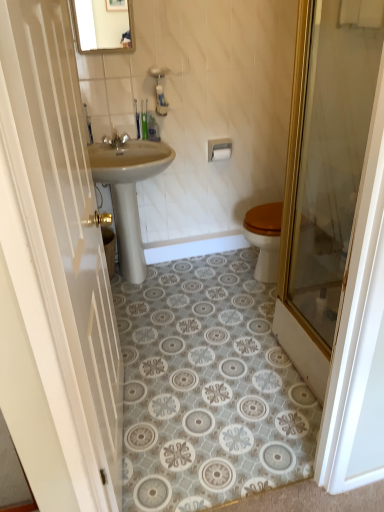
The width and height of the screenshot is (384, 512). Find the location of `white matte toilet paper at upper center`. white matte toilet paper at upper center is located at coordinates (221, 154).

Measure the distance between beige ceramic sink at center and camera.

They are 2.17 meters apart.

I want to click on beige ceramic sink at center, so click(x=128, y=193).

Identify the location of silver metallic towel bar at upper center. (219, 149).

Locate an element on the screen. The height and width of the screenshot is (512, 384). white matte toilet paper at upper center is located at coordinates (221, 154).

Is beige ceramic sink at center bigger or smaller than silver metallic faucet at upper center?

In the image, beige ceramic sink at center appears to be larger than silver metallic faucet at upper center.

Could you tell me if beige ceramic sink at center is turned towards silver metallic faucet at upper center?

No, beige ceramic sink at center is not facing towards silver metallic faucet at upper center.

In the scene shown: What's the angular difference between beige ceramic sink at center and silver metallic faucet at upper center's facing directions?

They differ by 0.0031 degrees in their facing directions.

Can you confirm if silver metallic towel bar at upper center is wider than translucent glass door at right, marked as the first door in a right-to-left arrangement?

Incorrect, the width of silver metallic towel bar at upper center does not surpass that of translucent glass door at right, marked as the first door in a right-to-left arrangement.

Consider the image. Is silver metallic towel bar at upper center inside or outside of translucent glass door at right, which is the 2th door in left-to-right order?

silver metallic towel bar at upper center cannot be found inside translucent glass door at right, which is the 2th door in left-to-right order.

From the image's perspective, which one is positioned higher, silver metallic towel bar at upper center or translucent glass door at right, which is the 2th door in left-to-right order?

silver metallic towel bar at upper center appears higher in the image.

Which object is closer to the camera taking this photo, silver metallic towel bar at upper center or translucent glass door at right, marked as the first door in a right-to-left arrangement?

translucent glass door at right, marked as the first door in a right-to-left arrangement.

How different are the orientations of white matte toilet paper at upper center and silver metallic towel bar at upper center in degrees?

white matte toilet paper at upper center and silver metallic towel bar at upper center are facing 1.89 degrees away from each other.

Considering the sizes of objects white matte toilet paper at upper center and silver metallic towel bar at upper center in the image provided, who is taller, white matte toilet paper at upper center or silver metallic towel bar at upper center?

Standing taller between the two is silver metallic towel bar at upper center.

How distant is white matte toilet paper at upper center from silver metallic towel bar at upper center?

white matte toilet paper at upper center and silver metallic towel bar at upper center are 1.21 centimeters apart from each other.

From the image's perspective, which one is positioned higher, white matte toilet paper at upper center or silver metallic towel bar at upper center?

silver metallic towel bar at upper center, from the image's perspective.

Is silver metallic faucet at upper center outside of white glossy door at left, arranged as the 1th door when viewed from the left?

Yes, silver metallic faucet at upper center is not within white glossy door at left, arranged as the 1th door when viewed from the left.

Is point (108, 138) positioned before point (43, 27)?

No, (108, 138) is behind (43, 27).

In terms of height, does silver metallic faucet at upper center look taller or shorter compared to white glossy door at left, arranged as the 1th door when viewed from the left?

Clearly, silver metallic faucet at upper center is shorter compared to white glossy door at left, arranged as the 1th door when viewed from the left.

Which is more to the left, silver metallic faucet at upper center or white glossy door at left, the 2th door from the right?

Positioned to the left is silver metallic faucet at upper center.

Who is more distant, white glossy door at left, the 2th door from the right, or silver metallic faucet at upper center?

silver metallic faucet at upper center is more distant.

Looking at this image, can you confirm if white glossy door at left, the 2th door from the right, is thinner than silver metallic faucet at upper center?

In fact, white glossy door at left, the 2th door from the right, might be wider than silver metallic faucet at upper center.

Does white glossy door at left, the 2th door from the right, have a lesser height compared to silver metallic faucet at upper center?

No.

Is white glossy door at left, the 2th door from the right, positioned beyond the bounds of silver metallic faucet at upper center?

Yes, white glossy door at left, the 2th door from the right, is located beyond the bounds of silver metallic faucet at upper center.

How far apart are white matte toilet paper at upper center and matte glass mirror at upper center?

A distance of 37.38 inches exists between white matte toilet paper at upper center and matte glass mirror at upper center.

Which is less distant, (213, 154) or (109, 6)?

Point (213, 154) is positioned farther from the camera compared to point (109, 6).

Are white matte toilet paper at upper center and matte glass mirror at upper center far apart?

No, white matte toilet paper at upper center is in close proximity to matte glass mirror at upper center.

Where is `mirror that is in front of the white matte toilet paper at upper center`? mirror that is in front of the white matte toilet paper at upper center is located at coordinates (103, 25).

Can you confirm if translucent glass door at right, which is the 2th door in left-to-right order, is wider than matte glass mirror at upper center?

Correct, the width of translucent glass door at right, which is the 2th door in left-to-right order, exceeds that of matte glass mirror at upper center.

From the image's perspective, which object appears higher, translucent glass door at right, which is the 2th door in left-to-right order, or matte glass mirror at upper center?

matte glass mirror at upper center is shown above in the image.

Can you confirm if translucent glass door at right, marked as the first door in a right-to-left arrangement, is smaller than matte glass mirror at upper center?

Incorrect, translucent glass door at right, marked as the first door in a right-to-left arrangement, is not smaller in size than matte glass mirror at upper center.

Is the surface of translucent glass door at right, which is the 2th door in left-to-right order, in direct contact with matte glass mirror at upper center?

No, translucent glass door at right, which is the 2th door in left-to-right order, is not in contact with matte glass mirror at upper center.

Find the location of a particular element. The height and width of the screenshot is (512, 384). sink below the silver metallic faucet at upper center (from the image's perspective) is located at coordinates (128, 193).

Identify the location of the 1st door in front when counting from the silver metallic towel bar at upper center. This screenshot has height=512, width=384. (322, 179).

When comparing their distances from white glossy door at left, the 2th door from the right, does beige ceramic sink at center or matte glass mirror at upper center seem further?

matte glass mirror at upper center.

Based on their spatial positions, is white matte toilet paper at upper center or white glossy door at left, the 2th door from the right, further from matte glass mirror at upper center?

Based on the image, white glossy door at left, the 2th door from the right, appears to be further to matte glass mirror at upper center.

Which object lies nearer to the anchor point silver metallic towel bar at upper center, translucent glass door at right, which is the 2th door in left-to-right order, or beige ceramic sink at center?

Based on the image, beige ceramic sink at center appears to be nearer to silver metallic towel bar at upper center.

Which object lies nearer to the anchor point silver metallic faucet at upper center, silver metallic towel bar at upper center or white glossy door at left, arranged as the 1th door when viewed from the left?

Among the two, silver metallic towel bar at upper center is located nearer to silver metallic faucet at upper center.

From the image, which object appears to be nearer to translucent glass door at right, marked as the first door in a right-to-left arrangement, white glossy door at left, arranged as the 1th door when viewed from the left, or beige ceramic sink at center?

The object closer to translucent glass door at right, marked as the first door in a right-to-left arrangement, is white glossy door at left, arranged as the 1th door when viewed from the left.

When comparing their distances from matte glass mirror at upper center, does silver metallic faucet at upper center or translucent glass door at right, marked as the first door in a right-to-left arrangement, seem further?

Based on the image, translucent glass door at right, marked as the first door in a right-to-left arrangement, appears to be further to matte glass mirror at upper center.

Which object lies nearer to the anchor point white glossy door at left, arranged as the 1th door when viewed from the left, silver metallic towel bar at upper center or translucent glass door at right, which is the 2th door in left-to-right order?

Among the two, translucent glass door at right, which is the 2th door in left-to-right order, is located nearer to white glossy door at left, arranged as the 1th door when viewed from the left.

From the image, which object appears to be farther from beige ceramic sink at center, translucent glass door at right, which is the 2th door in left-to-right order, or matte glass mirror at upper center?

translucent glass door at right, which is the 2th door in left-to-right order, is positioned further to the anchor beige ceramic sink at center.

The width and height of the screenshot is (384, 512). In order to click on door positioned between white glossy door at left, arranged as the 1th door when viewed from the left, and beige ceramic sink at center from near to far in this screenshot , I will do `click(322, 179)`.

I want to click on sink between white glossy door at left, arranged as the 1th door when viewed from the left, and silver metallic faucet at upper center in the front-back direction, so click(128, 193).

You are a GUI agent. You are given a task and a screenshot of the screen. Output one action in this format:
    pyautogui.click(x=<x>, y=<y>)
    Task: Click on the mirror positioned between white glossy door at left, the 2th door from the right, and white matte toilet paper at upper center from near to far
    The width and height of the screenshot is (384, 512).
    Given the screenshot: What is the action you would take?
    pyautogui.click(x=103, y=25)

Identify the location of tap between matte glass mirror at upper center and beige ceramic sink at center in the vertical direction. (116, 139).